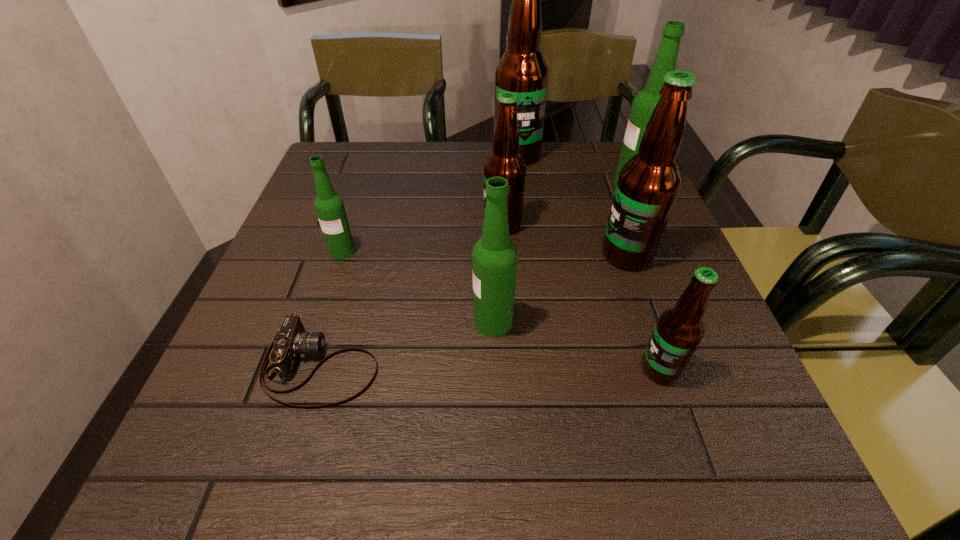
In the image, there is a desktop. Identify the location of vacant space at the far left corner. (355, 145).

Image resolution: width=960 pixels, height=540 pixels. I want to click on free space at the near left corner of the desktop, so click(228, 447).

The image size is (960, 540). I want to click on vacant space at the far right corner, so click(577, 150).

The height and width of the screenshot is (540, 960). Find the location of `vacant point located between the sixth nearest beer bottle and the farthest brown beer bottle`. vacant point located between the sixth nearest beer bottle and the farthest brown beer bottle is located at coordinates (574, 170).

Find the location of a particular element. Image resolution: width=960 pixels, height=540 pixels. vacant area that lies between the farthest object and the leftmost beer bottle is located at coordinates (429, 204).

This screenshot has width=960, height=540. In order to click on free area in between the third farthest brown beer bottle and the sixth farthest beer bottle in this screenshot , I will do `click(560, 288)`.

The image size is (960, 540). I want to click on blank region between the sixth nearest object and the leftmost beer bottle, so click(422, 238).

I want to click on free point between the second green beer bottle from left to right and the sixth nearest beer bottle, so click(563, 253).

The image size is (960, 540). In order to click on empty location between the farthest brown beer bottle and the leftmost green beer bottle in this screenshot , I will do `click(429, 204)`.

Identify the location of vacant area that lies between the third smallest brown beer bottle and the second nearest beer bottle. (560, 288).